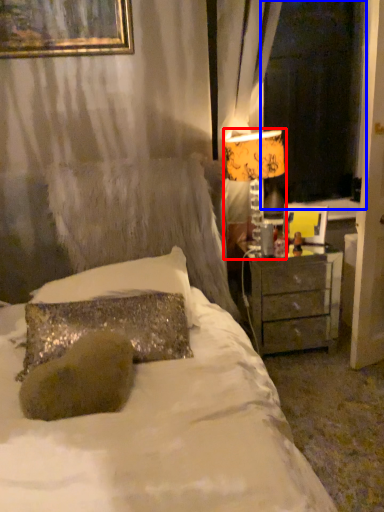
Question: Among these objects, which one is farthest to the camera, table lamp (highlighted by a red box) or window screen (highlighted by a blue box)?

Choices:
 (A) table lamp
 (B) window screen

Answer: (B)